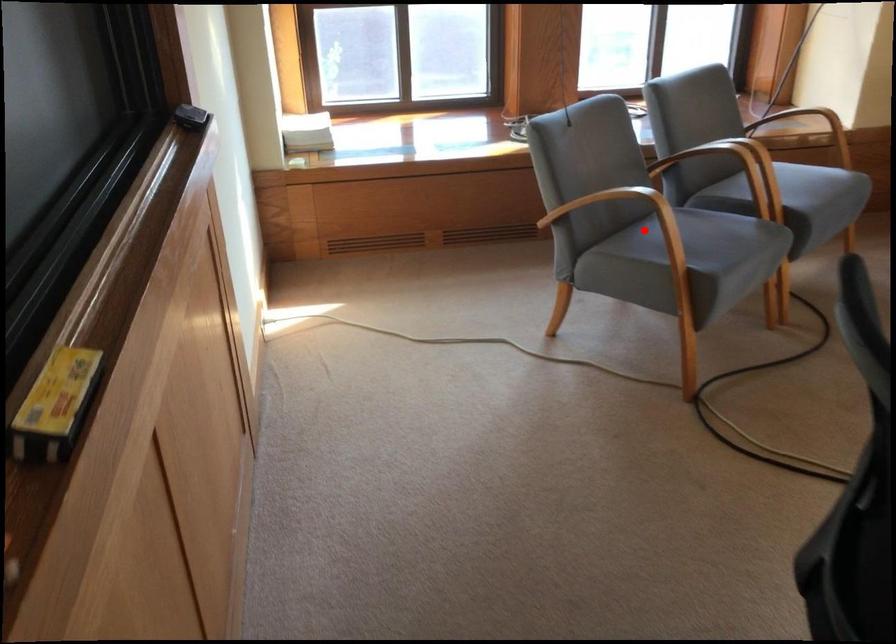
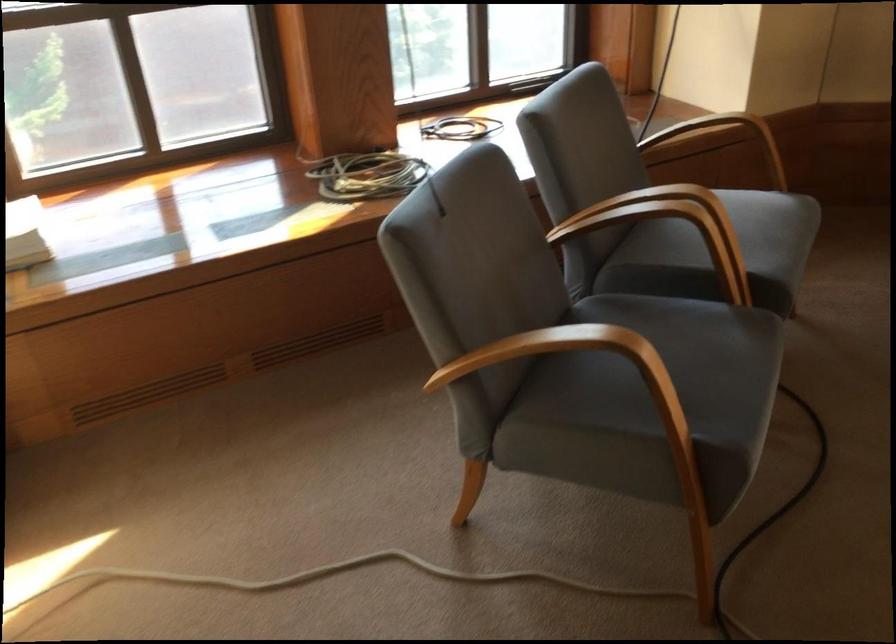
Question: I am providing you with two images of the same scene from different viewpoints. Given a red point in image1, look at the same physical point in image2. Is it:

Choices:
 (A) Closer to the viewpoint
 (B) Farther from the viewpoint

Answer: (A)